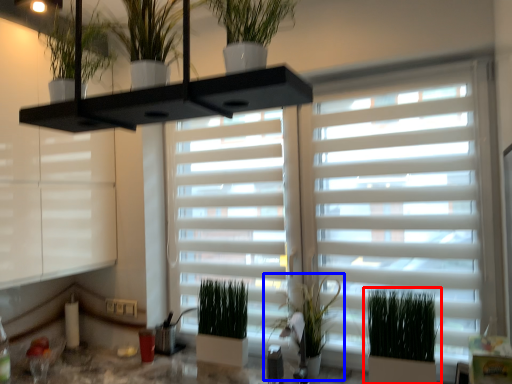
Question: Which object appears closest to the camera in this image, houseplant (highlighted by a red box) or houseplant (highlighted by a blue box)?

Choices:
 (A) houseplant
 (B) houseplant

Answer: (A)